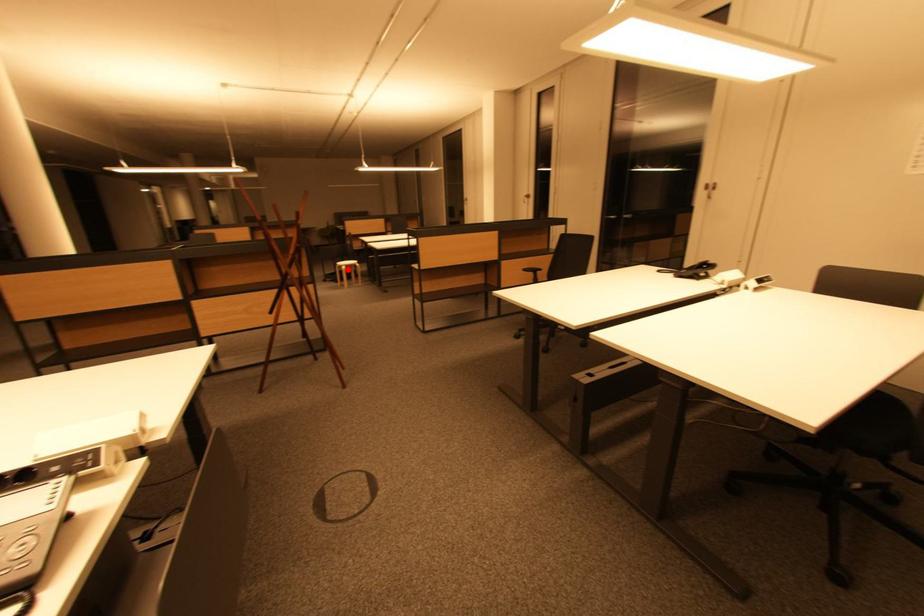
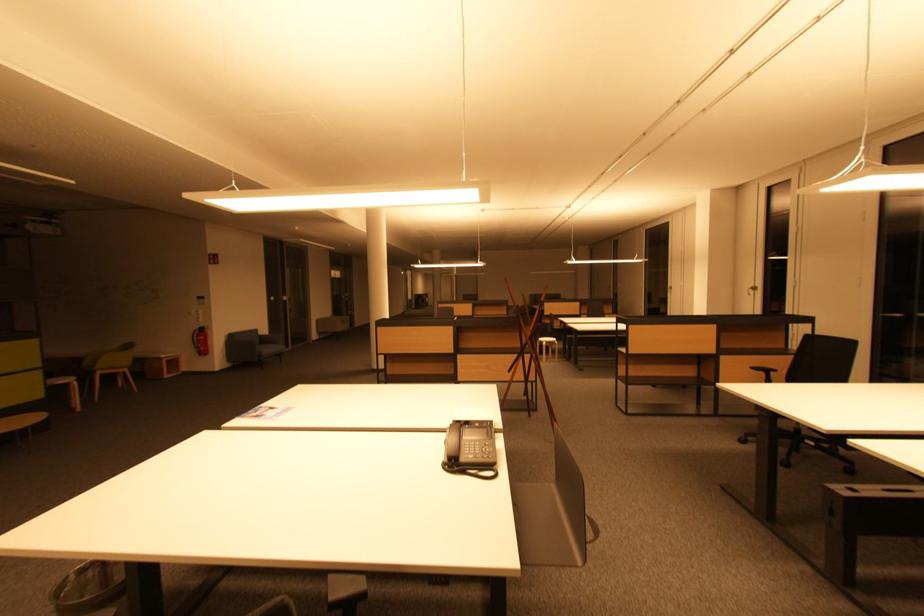
The point at the highlighted location is marked in the first image. Where is the corresponding point in the second image?

(549, 345)